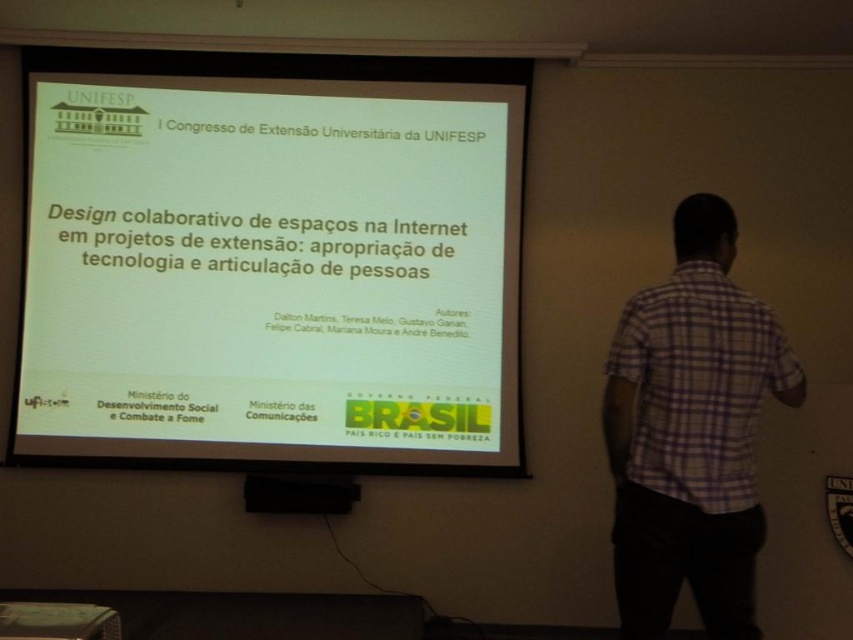
Question: Which point is farther to the camera?

Choices:
 (A) (691, 260)
 (B) (10, 460)

Answer: (B)

Question: Does white matte projector screen at center appear on the left side of purple checkered shirt at right?

Choices:
 (A) yes
 (B) no

Answer: (A)

Question: Is white matte projector screen at center above purple checkered shirt at right?

Choices:
 (A) yes
 (B) no

Answer: (A)

Question: Which point is farther to the camera?

Choices:
 (A) purple checkered shirt at right
 (B) white matte projector screen at center

Answer: (B)

Question: Can you confirm if white matte projector screen at center is positioned to the right of purple checkered shirt at right?

Choices:
 (A) yes
 (B) no

Answer: (B)